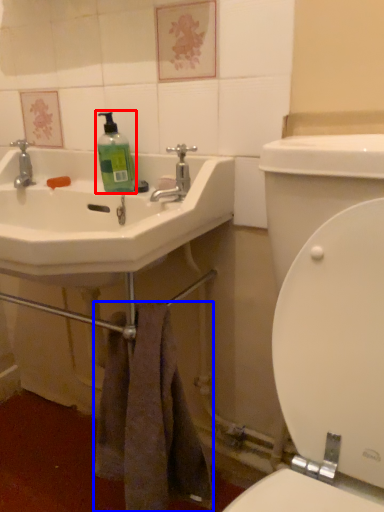
Question: Which object appears farthest to the camera in this image, cleaning product (highlighted by a red box) or towel/napkin (highlighted by a blue box)?

Choices:
 (A) cleaning product
 (B) towel/napkin

Answer: (A)